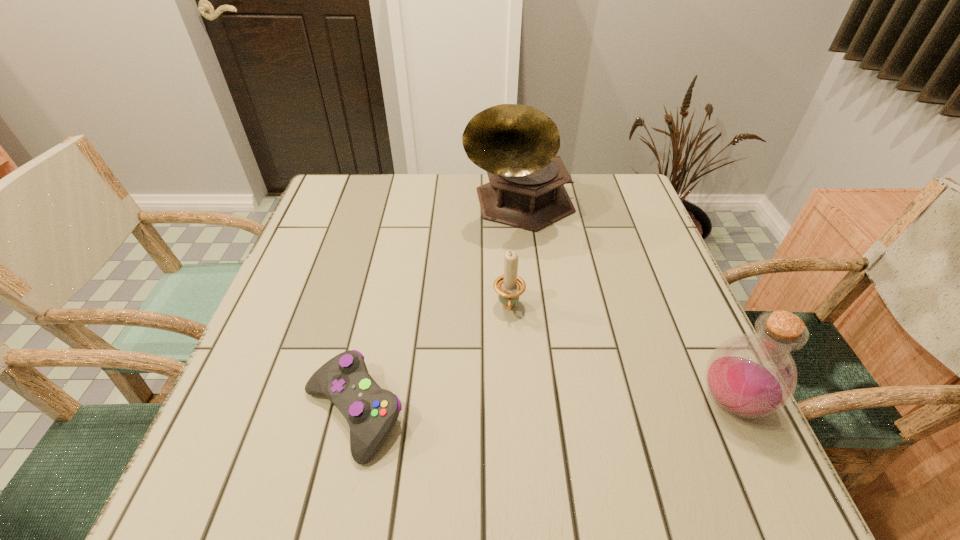
Where is `vacant spot on the desktop that is between the control and the second tallest object and is positioned on the handle side of the third nearest object`? The image size is (960, 540). vacant spot on the desktop that is between the control and the second tallest object and is positioned on the handle side of the third nearest object is located at coordinates (510, 408).

The width and height of the screenshot is (960, 540). What are the coordinates of `free space on the desktop that is between the leftmost object and the second tallest object and is positioned on the horn direction of the phonograph record` in the screenshot? It's located at (587, 406).